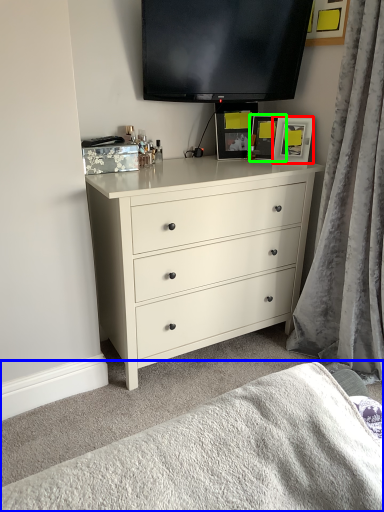
Question: Estimate the real-world distances between objects in this image. Which object is closer to picture frame (highlighted by a red box), bedding (highlighted by a blue box) or picture frame (highlighted by a green box)?

Choices:
 (A) bedding
 (B) picture frame

Answer: (B)